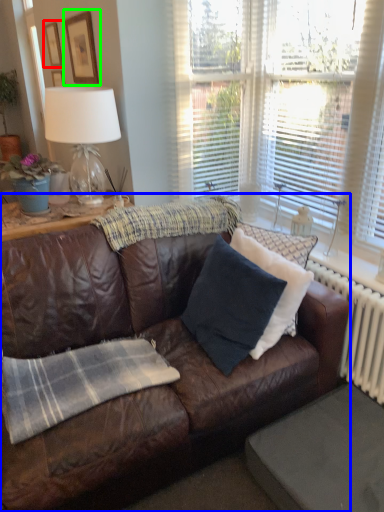
Question: Which is nearer to the picture frame (highlighted by a red box)? studio couch (highlighted by a blue box) or picture frame (highlighted by a green box).

Choices:
 (A) studio couch
 (B) picture frame

Answer: (B)